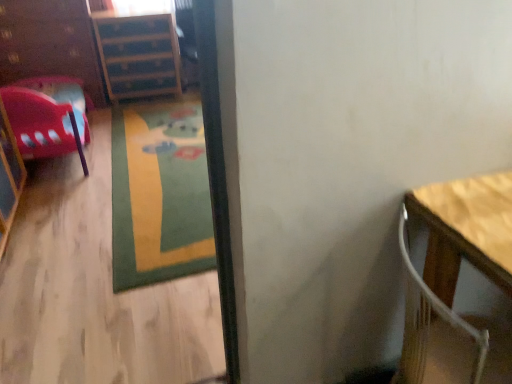
What do you see at coordinates (456, 279) in the screenshot?
I see `wooden table at right` at bounding box center [456, 279].

Image resolution: width=512 pixels, height=384 pixels. What do you see at coordinates (45, 124) in the screenshot?
I see `matte plastic chair at left` at bounding box center [45, 124].

This screenshot has width=512, height=384. Describe the element at coordinates (93, 290) in the screenshot. I see `wooden floor at lower left` at that location.

The width and height of the screenshot is (512, 384). What do you see at coordinates (138, 54) in the screenshot? I see `wooden file cabinet at upper left` at bounding box center [138, 54].

What do you see at coordinates (49, 43) in the screenshot? The width and height of the screenshot is (512, 384). I see `brushed wood dresser at left` at bounding box center [49, 43].

Where is `wooden table at right`? wooden table at right is located at coordinates (456, 279).

Can you confirm if wooden file cabinet at upper left is positioned to the left of green carpet at center?

Indeed, wooden file cabinet at upper left is positioned on the left side of green carpet at center.

From the image's perspective, would you say wooden file cabinet at upper left is positioned over green carpet at center?

Correct, wooden file cabinet at upper left appears higher than green carpet at center in the image.

Considering the relative sizes of wooden file cabinet at upper left and green carpet at center in the image provided, is wooden file cabinet at upper left shorter than green carpet at center?

Incorrect, the height of wooden file cabinet at upper left does not fall short of that of green carpet at center.

Locate an element on the screen. The width and height of the screenshot is (512, 384). file cabinet that is above the green carpet at center (from a real-world perspective) is located at coordinates 138,54.

Identify the location of chair lying behind the wooden floor at lower left. (45, 124).

From their relative heights in the image, would you say matte plastic chair at left is taller or shorter than wooden floor at lower left?

Considering their sizes, matte plastic chair at left has less height than wooden floor at lower left.

Which object is closer to the camera, matte plastic chair at left or wooden floor at lower left?

Positioned in front is wooden floor at lower left.

From the picture: From a real-world perspective, is matte plastic chair at left physically located above or below wooden floor at lower left?

Clearly, from a real-world perspective, matte plastic chair at left is below wooden floor at lower left.

Considering the relative sizes of matte plastic chair at left and green carpet at center in the image provided, is matte plastic chair at left smaller than green carpet at center?

No.

Measure the distance from matte plastic chair at left to green carpet at center.

matte plastic chair at left and green carpet at center are 58.97 centimeters apart.

Is matte plastic chair at left outside of green carpet at center?

matte plastic chair at left lies outside green carpet at center's area.

Is matte plastic chair at left positioned in front of green carpet at center?

No, matte plastic chair at left is behind green carpet at center.

Is wooden file cabinet at upper left oriented away from brushed wood dresser at left?

No.

Can you confirm if wooden file cabinet at upper left is taller than brushed wood dresser at left?

No.

There is a wooden file cabinet at upper left. Where is `dresser above it (from a real-world perspective)`? This screenshot has width=512, height=384. dresser above it (from a real-world perspective) is located at coordinates (49, 43).

From a real-world perspective, is wooden file cabinet at upper left physically located above or below brushed wood dresser at left?

From a real-world perspective, wooden file cabinet at upper left is physically below brushed wood dresser at left.

Locate an element on the screen. corridor on the left of the wooden table at right is located at coordinates (93, 290).

Is wooden table at right not close to wooden floor at lower left?

wooden table at right is positioned a significant distance from wooden floor at lower left.

Which of these two, wooden table at right or wooden floor at lower left, is wider?

wooden table at right is wider.

Do you think wooden table at right is within wooden floor at lower left, or outside of it?

wooden table at right lies outside wooden floor at lower left.

Does wooden table at right turn towards brushed wood dresser at left?

No, wooden table at right is not aimed at brushed wood dresser at left.

Considering their positions, is wooden table at right located in front of or behind brushed wood dresser at left?

Clearly, wooden table at right is in front of brushed wood dresser at left.

Are wooden table at right and brushed wood dresser at left far apart?

That's right, there is a large distance between wooden table at right and brushed wood dresser at left.

Who is smaller, wooden table at right or brushed wood dresser at left?

With smaller size is wooden table at right.

Which of these two, wooden floor at lower left or brushed wood dresser at left, is smaller?

With smaller size is wooden floor at lower left.

Where is `dresser directly beneath the wooden floor at lower left (from a real-world perspective)`? Image resolution: width=512 pixels, height=384 pixels. dresser directly beneath the wooden floor at lower left (from a real-world perspective) is located at coordinates (49, 43).

Which object is further away from the camera taking this photo, wooden floor at lower left or brushed wood dresser at left?

brushed wood dresser at left is more distant.

Locate an element on the screen. This screenshot has width=512, height=384. file cabinet above the green carpet at center (from a real-world perspective) is located at coordinates (138, 54).

In order to click on chair located on the left of wooden floor at lower left in this screenshot , I will do `click(45, 124)`.

Estimate the real-world distances between objects in this image. Which object is further from brushed wood dresser at left, green carpet at center or wooden table at right?

Based on the image, wooden table at right appears to be further to brushed wood dresser at left.

Based on their spatial positions, is brushed wood dresser at left or wooden table at right closer to green carpet at center?

brushed wood dresser at left is closer to green carpet at center.

Estimate the real-world distances between objects in this image. Which object is further from matte plastic chair at left, wooden floor at lower left or wooden file cabinet at upper left?

wooden file cabinet at upper left lies further to matte plastic chair at left than the other object.

Which object lies further to the anchor point wooden file cabinet at upper left, matte plastic chair at left or green carpet at center?

Based on the image, green carpet at center appears to be further to wooden file cabinet at upper left.

Considering their positions, is wooden table at right positioned closer to green carpet at center than wooden file cabinet at upper left?

The object closer to green carpet at center is wooden file cabinet at upper left.

Based on their spatial positions, is matte plastic chair at left or green carpet at center further from wooden floor at lower left?

matte plastic chair at left is further to wooden floor at lower left.

When comparing their distances from wooden file cabinet at upper left, does green carpet at center or wooden floor at lower left seem closer?

green carpet at center.

Estimate the real-world distances between objects in this image. Which object is closer to wooden floor at lower left, wooden table at right or green carpet at center?

Based on the image, green carpet at center appears to be nearer to wooden floor at lower left.

I want to click on mat between wooden floor at lower left and wooden file cabinet at upper left in the front-back direction, so click(159, 195).

The height and width of the screenshot is (384, 512). Find the location of `chair between green carpet at center and wooden file cabinet at upper left along the z-axis`. chair between green carpet at center and wooden file cabinet at upper left along the z-axis is located at coordinates (45, 124).

In order to click on table between wooden floor at lower left and wooden file cabinet at upper left from front to back in this screenshot , I will do `click(456, 279)`.

In order to click on mat positioned between wooden table at right and brushed wood dresser at left from near to far in this screenshot , I will do `click(159, 195)`.